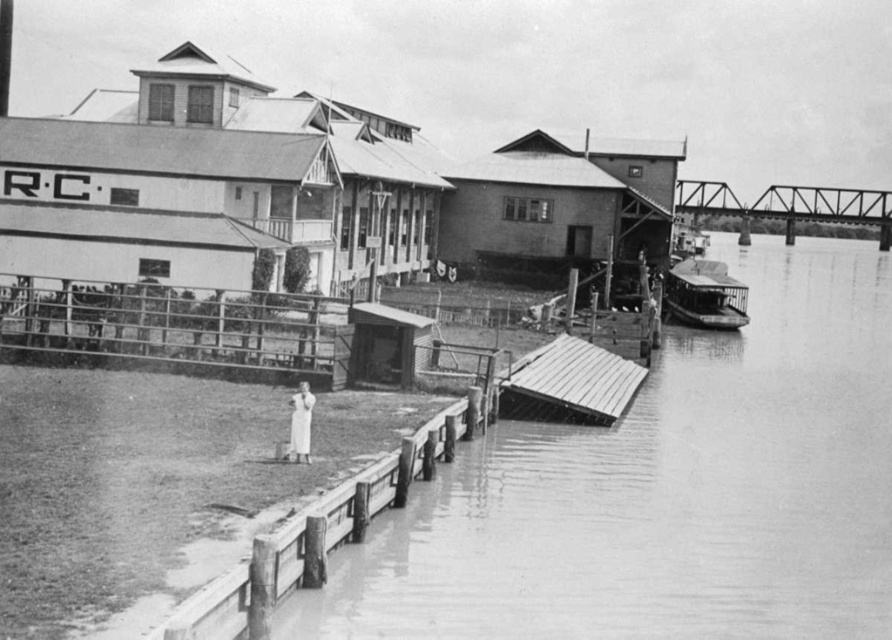
Question: From the image, what is the correct spatial relationship of smooth concrete dock at lower center in relation to white cotton dress at lower left?

Choices:
 (A) below
 (B) above

Answer: (B)

Question: Which of the following is the closest to the observer?

Choices:
 (A) (732, 280)
 (B) (370, 536)

Answer: (B)

Question: Is smooth wooden boat at right further to camera compared to white cotton dress at lower left?

Choices:
 (A) yes
 (B) no

Answer: (A)

Question: Is smooth wooden boat at right thinner than white cotton dress at lower left?

Choices:
 (A) yes
 (B) no

Answer: (B)

Question: Which point appears farthest from the camera in this image?

Choices:
 (A) (855, 470)
 (B) (605, 365)
 (C) (717, 291)
 (D) (304, 401)

Answer: (C)

Question: Estimate the real-world distances between objects in this image. Which object is farther from the metallic gray dock at lower center?

Choices:
 (A) smooth wooden boat at right
 (B) smooth concrete dock at lower center

Answer: (A)